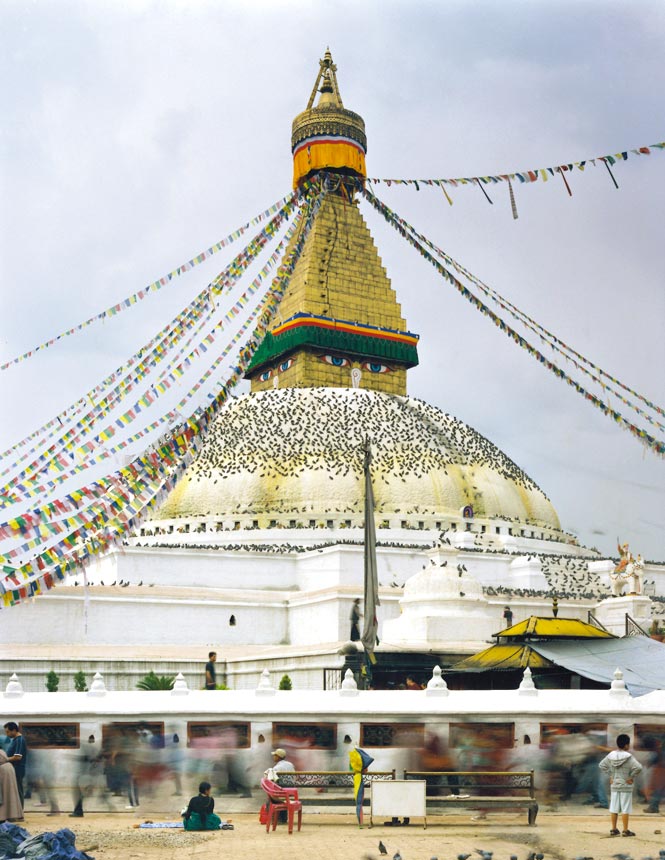
Where is `wall`? Image resolution: width=665 pixels, height=860 pixels. wall is located at coordinates pyautogui.click(x=348, y=734), pyautogui.click(x=295, y=673), pyautogui.click(x=124, y=676), pyautogui.click(x=124, y=618), pyautogui.click(x=308, y=628), pyautogui.click(x=205, y=573), pyautogui.click(x=102, y=566), pyautogui.click(x=323, y=582), pyautogui.click(x=356, y=574), pyautogui.click(x=386, y=611).